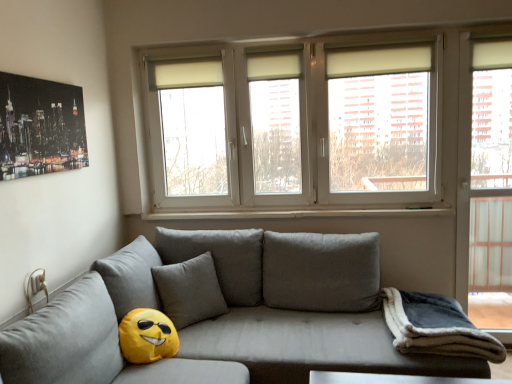
This screenshot has width=512, height=384. Find the location of `blank space situated above white matte curtain at upper center, placed as the first curtain when sorted from left to right (from a real-world perspective)`. blank space situated above white matte curtain at upper center, placed as the first curtain when sorted from left to right (from a real-world perspective) is located at coordinates (185, 54).